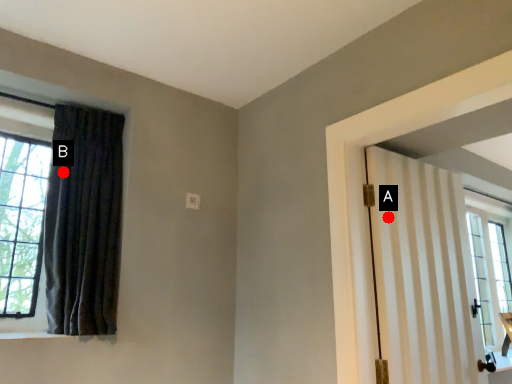
Question: Two points are circled on the image, labeled by A and B beside each circle. Which point is closer to the camera?

Choices:
 (A) A is closer
 (B) B is closer

Answer: (A)